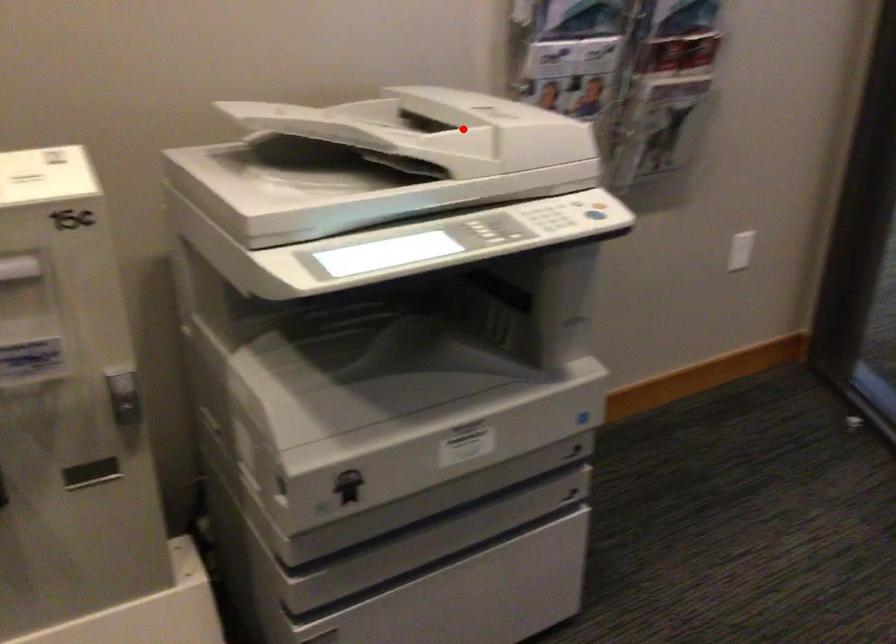
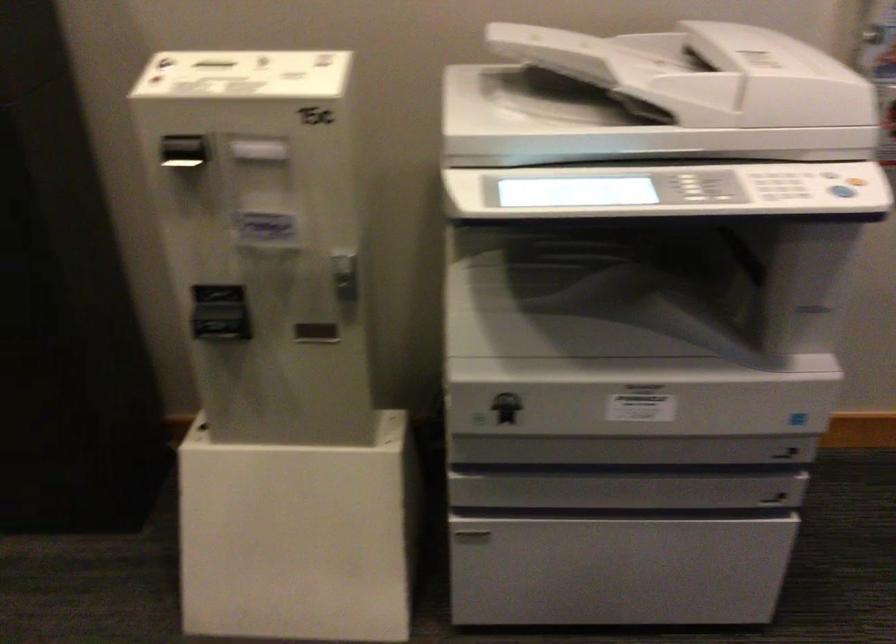
Where in the second image is the point corresponding to the highlighted location from the first image?

(702, 73)